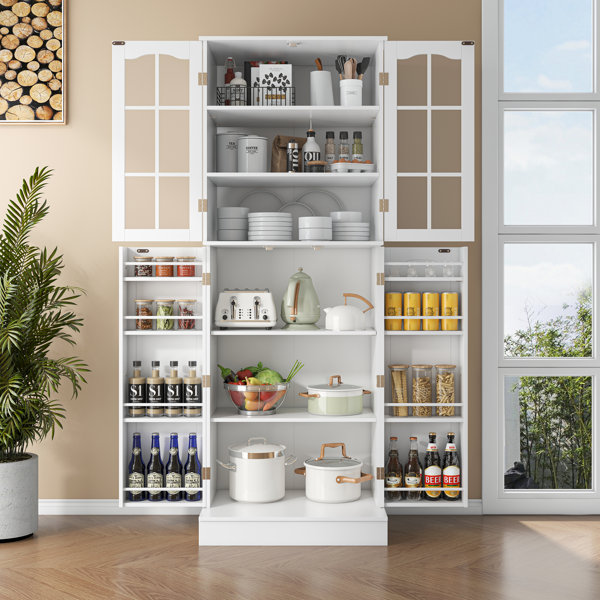
Identify the location of things you use on the stove top. The width and height of the screenshot is (600, 600). (269, 468), (331, 484), (347, 401), (355, 322).